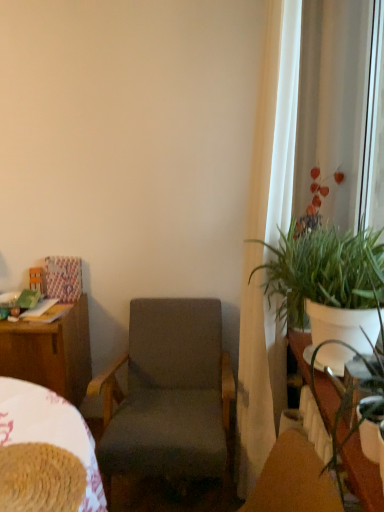
Identify the location of green leafy plant at right. (323, 273).

What do you see at coordinates (275, 123) in the screenshot?
I see `white sheer curtain at right` at bounding box center [275, 123].

Identify the location of woven fabric bed at lower left. The width and height of the screenshot is (384, 512). (50, 430).

You are a GUI agent. You are given a task and a screenshot of the screen. Output one action in this format:
    pyautogui.click(x=<x>, y=<y>)
    Task: Click on the wooden desk at left
    
    Given the screenshot: What is the action you would take?
    pyautogui.click(x=50, y=352)

Can you confirm if dark gray fabric chair at center is bigger than woven fabric bed at lower left?

Indeed, dark gray fabric chair at center has a larger size compared to woven fabric bed at lower left.

Is point (196, 419) closer or farther from the camera than point (8, 437)?

Point (196, 419) is farther from the camera than point (8, 437).

Considering the sizes of objects dark gray fabric chair at center and woven fabric bed at lower left in the image provided, who is shorter, dark gray fabric chair at center or woven fabric bed at lower left?

woven fabric bed at lower left.

Is dark gray fabric chair at center not inside woven fabric bed at lower left?

Yes, dark gray fabric chair at center is outside of woven fabric bed at lower left.

Is white glossy table at right taller than dark gray fabric chair at center?

In fact, white glossy table at right may be shorter than dark gray fabric chair at center.

From the image's perspective, which is below, white glossy table at right or dark gray fabric chair at center?

dark gray fabric chair at center.

Is white glossy table at right oriented towards dark gray fabric chair at center?

No, white glossy table at right is not aimed at dark gray fabric chair at center.

At what (x,y) coordinates should I click in order to perform the action: click on chair below the white glossy table at right (from the image's perspective). Please return your answer as a coordinate pair (x, y). Image resolution: width=384 pixels, height=512 pixels. Looking at the image, I should click on (168, 395).

Is white sheer curtain at right directly adjacent to dark gray fabric chair at center?

No, white sheer curtain at right is not with dark gray fabric chair at center.

Which object is positioned more to the left, white sheer curtain at right or dark gray fabric chair at center?

dark gray fabric chair at center is more to the left.

Where is `curtain in front of the dark gray fabric chair at center`? This screenshot has height=512, width=384. curtain in front of the dark gray fabric chair at center is located at coordinates (275, 123).

Relative to green leafy plant at right, is dark gray fabric chair at center in front or behind?

Clearly, dark gray fabric chair at center is behind green leafy plant at right.

Considering the sizes of objects dark gray fabric chair at center and green leafy plant at right in the image provided, who is wider, dark gray fabric chair at center or green leafy plant at right?

With larger width is dark gray fabric chair at center.

From a real-world perspective, is dark gray fabric chair at center below green leafy plant at right?

Yes, from a real-world perspective, dark gray fabric chair at center is beneath green leafy plant at right.

Is dark gray fabric chair at center facing towards green leafy plant at right?

No.

Considering their positions, is woven fabric bed at lower left located in front of or behind white sheer curtain at right?

Clearly, woven fabric bed at lower left is in front of white sheer curtain at right.

Can you confirm if woven fabric bed at lower left is smaller than white sheer curtain at right?

Indeed, woven fabric bed at lower left has a smaller size compared to white sheer curtain at right.

In the scene shown: From the image's perspective, would you say woven fabric bed at lower left is shown under white sheer curtain at right?

Yes, from the image's perspective, woven fabric bed at lower left is below white sheer curtain at right.

Which is nearer, (x=34, y=434) or (x=258, y=257)?

Point (x=34, y=434) appears to be closer to the viewer than point (x=258, y=257).

Looking at this image, considering the sizes of white glossy table at right and wooden desk at left in the image, is white glossy table at right wider or thinner than wooden desk at left?

white glossy table at right is thinner than wooden desk at left.

Is the depth of white glossy table at right greater than that of wooden desk at left?

That is False.

From the picture: What's the angular difference between white glossy table at right and wooden desk at left's facing directions?

There is a 90.3-degree angle between the facing directions of white glossy table at right and wooden desk at left.

Is wooden desk at left inside the boundaries of white glossy table at right, or outside?

wooden desk at left is not inside white glossy table at right, it's outside.

Is wooden desk at left closer to camera compared to white glossy table at right?

No, it is not.

Can you confirm if wooden desk at left is positioned to the left of white glossy table at right?

Yes.

The image size is (384, 512). What are the coordinates of `bed above the dark gray fabric chair at center (from the image's perspective)` in the screenshot? It's located at (50, 430).

Identify the location of chair behind the white glossy table at right. This screenshot has width=384, height=512. (168, 395).

Based on the photo, considering their positions, is white glossy table at right positioned further to white sheer curtain at right than dark gray fabric chair at center?

white glossy table at right.

Looking at the image, which one is located closer to green leafy plant at right, woven fabric bed at lower left or dark gray fabric chair at center?

dark gray fabric chair at center is positioned closer to the anchor green leafy plant at right.

Looking at the image, which one is located closer to woven fabric bed at lower left, white glossy table at right or wooden desk at left?

wooden desk at left is closer to woven fabric bed at lower left.

Looking at the image, which one is located further to white sheer curtain at right, green leafy plant at right or dark gray fabric chair at center?

dark gray fabric chair at center.

Which object lies nearer to the anchor point wooden desk at left, woven fabric bed at lower left or dark gray fabric chair at center?

dark gray fabric chair at center.

Looking at the image, which one is located further to green leafy plant at right, dark gray fabric chair at center or woven fabric bed at lower left?

Based on the image, woven fabric bed at lower left appears to be further to green leafy plant at right.

Looking at the image, which one is located closer to dark gray fabric chair at center, woven fabric bed at lower left or wooden desk at left?

Among the two, wooden desk at left is located nearer to dark gray fabric chair at center.

Based on their spatial positions, is dark gray fabric chair at center or white glossy table at right further from wooden desk at left?

white glossy table at right is further to wooden desk at left.

Where is `houseplant between white glossy table at right and dark gray fabric chair at center in the front-back direction`? Image resolution: width=384 pixels, height=512 pixels. houseplant between white glossy table at right and dark gray fabric chair at center in the front-back direction is located at coordinates (323, 273).

Identify the location of curtain between woven fabric bed at lower left and green leafy plant at right. This screenshot has height=512, width=384. (275, 123).

I want to click on curtain between wooden desk at left and green leafy plant at right in the horizontal direction, so click(x=275, y=123).

Locate an element on the screen. This screenshot has height=512, width=384. table between woven fabric bed at lower left and wooden desk at left in the front-back direction is located at coordinates (362, 475).